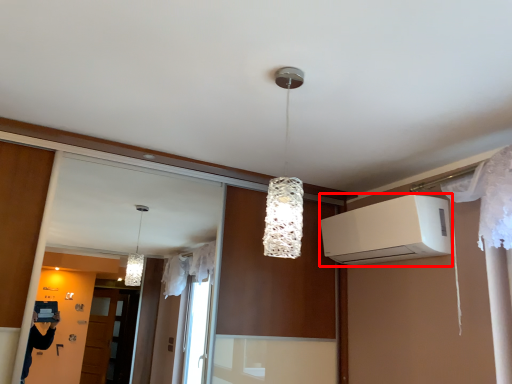
Question: From the image, what is the correct spatial relationship of air conditioning (annotated by the red box) in relation to lamp?

Choices:
 (A) right
 (B) left

Answer: (A)